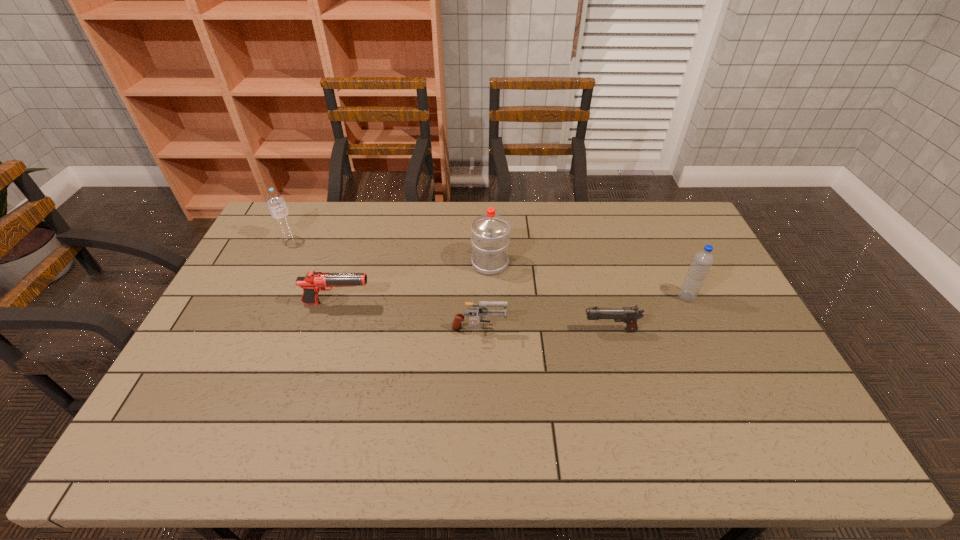
Where is `object that is the fifth closest one to the nearest water bottle`? Image resolution: width=960 pixels, height=540 pixels. object that is the fifth closest one to the nearest water bottle is located at coordinates (276, 203).

Locate an element on the screen. The image size is (960, 540). the second closest object to the second object from right to left is located at coordinates (482, 312).

Image resolution: width=960 pixels, height=540 pixels. I want to click on water bottle that is the third closest one to the fifth object from left to right, so click(x=276, y=203).

The height and width of the screenshot is (540, 960). I want to click on water bottle that is the second closest one to the second farthest water bottle, so (x=276, y=203).

Find the location of `the second closest gun to the rightmost gun`. the second closest gun to the rightmost gun is located at coordinates (313, 282).

Locate an element on the screen. the second closest gun to the second gun from right to left is located at coordinates (313, 282).